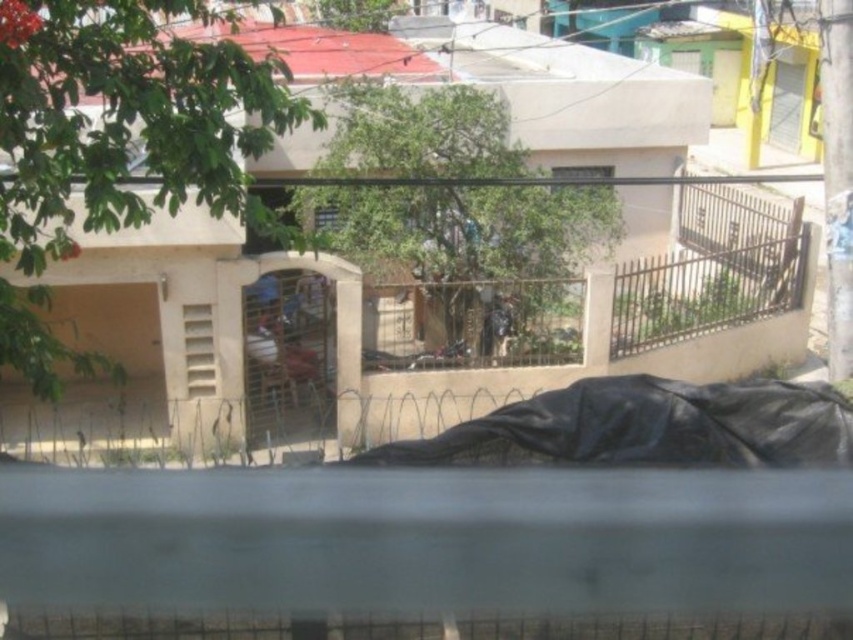
Consider the image. You are a delivery person who needs to place a heavy package on the ground in the residential area shown. You see the black tarp at center and the metallic wire cage at center. Which object should you avoid placing the package on to ensure it stays dry?

You should avoid placing the package on the black tarp at center because it is positioned under the metallic wire cage at center, which might collect rainwater or debris and drip onto the tarp.

You are a delivery person trying to navigate to the front entrance of the beige building. You see the black tarp at center and the metallic wire cage at center. Which object should you go around to reach the entrance?

The black tarp at center is on the right side of the metallic wire cage at center. To reach the entrance, go around the metallic wire cage at center to the left side since the black tarp at center is positioned to its right.

You are a delivery person trying to place a large package on the paved area in front of the beige building. The package is wider than the metallic wire cage at center. Can you place the package on the paved area without overlapping the black tarp at center?

The black tarp at center might be wider than metallic wire cage at center. Since the package is wider than the metallic wire cage at center, it might also be wider than the black tarp at center, so there is a possibility that placing the package might overlap the black tarp at center. You should check the exact dimensions before placing it.